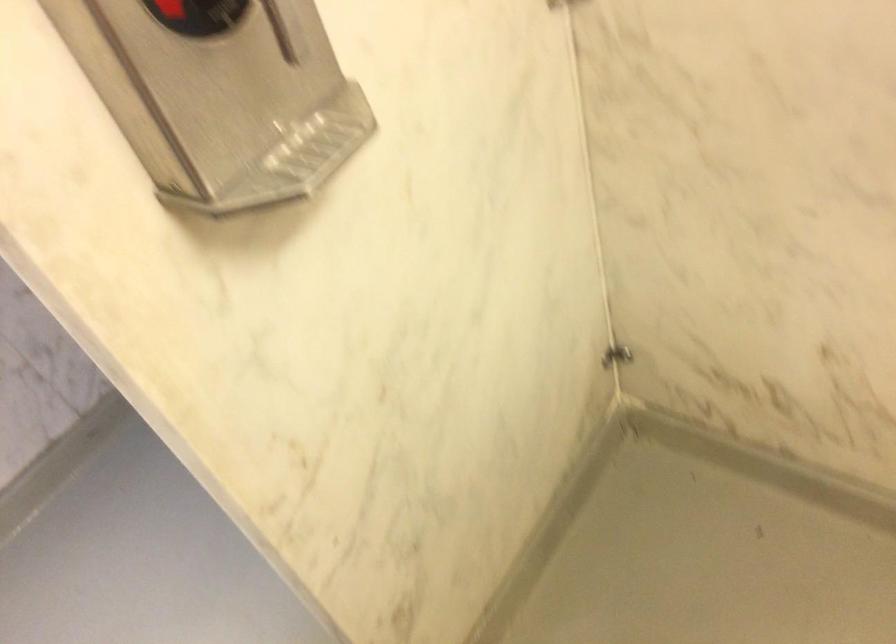
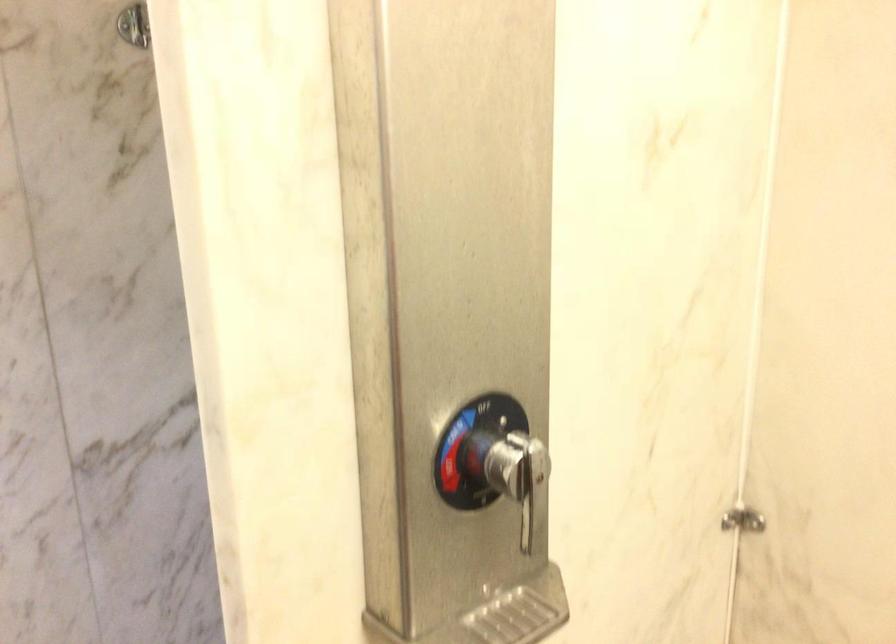
Question: How did the camera likely rotate?

Choices:
 (A) Left
 (B) Right
 (C) Up
 (D) Down

Answer: (C)